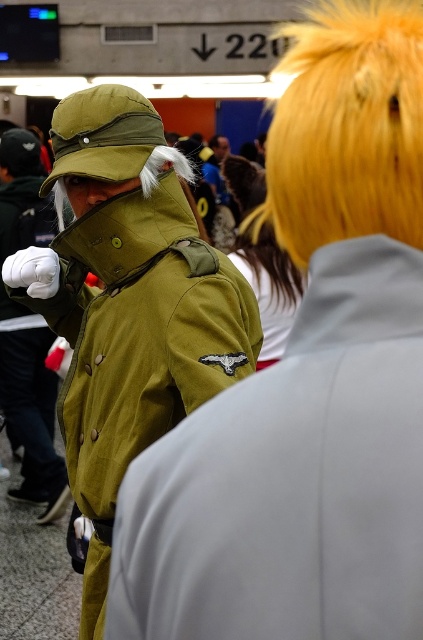
Question: Estimate the real-world distances between objects in this image. Which object is farther from the shiny golden wig at upper right?

Choices:
 (A) matte green jacket at left
 (B) matte green jacket at center

Answer: (B)

Question: Which point is closer to the camera?

Choices:
 (A) shiny golden wig at upper right
 (B) matte green jacket at left
 (C) matte green jacket at center

Answer: (A)

Question: Considering the relative positions of matte green jacket at left and shiny golden wig at upper right in the image provided, where is matte green jacket at left located with respect to shiny golden wig at upper right?

Choices:
 (A) above
 (B) below

Answer: (B)

Question: Can you confirm if matte green jacket at left is thinner than shiny golden wig at upper right?

Choices:
 (A) no
 (B) yes

Answer: (A)

Question: Does shiny golden wig at upper right have a larger size compared to matte green jacket at center?

Choices:
 (A) no
 (B) yes

Answer: (A)

Question: Which of the following is the closest to the observer?

Choices:
 (A) tap(2, 230)
 (B) tap(269, 202)

Answer: (B)